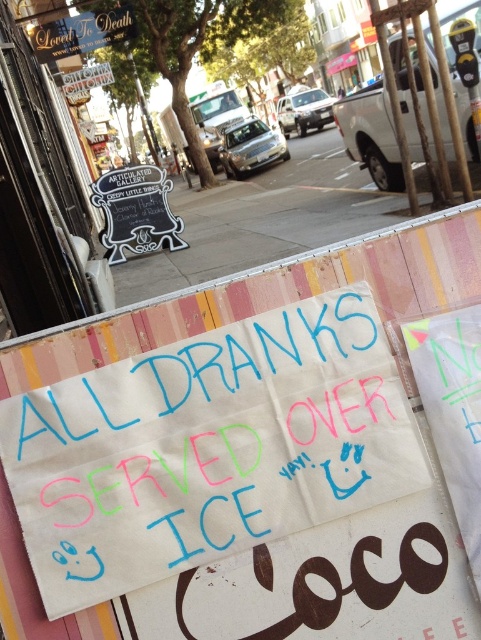
Question: Can you confirm if white paper sign at center is bigger than concrete sidewalk at center?

Choices:
 (A) no
 (B) yes

Answer: (A)

Question: Which point is farther to the camera?

Choices:
 (A) concrete sidewalk at center
 (B) white paper sign at center

Answer: (A)

Question: Does white paper sign at center appear on the right side of concrete sidewalk at center?

Choices:
 (A) yes
 (B) no

Answer: (B)

Question: Which point appears farthest from the camera in this image?

Choices:
 (A) (194, 228)
 (B) (88, 515)

Answer: (A)

Question: Is white paper sign at center positioned before concrete sidewalk at center?

Choices:
 (A) yes
 (B) no

Answer: (A)